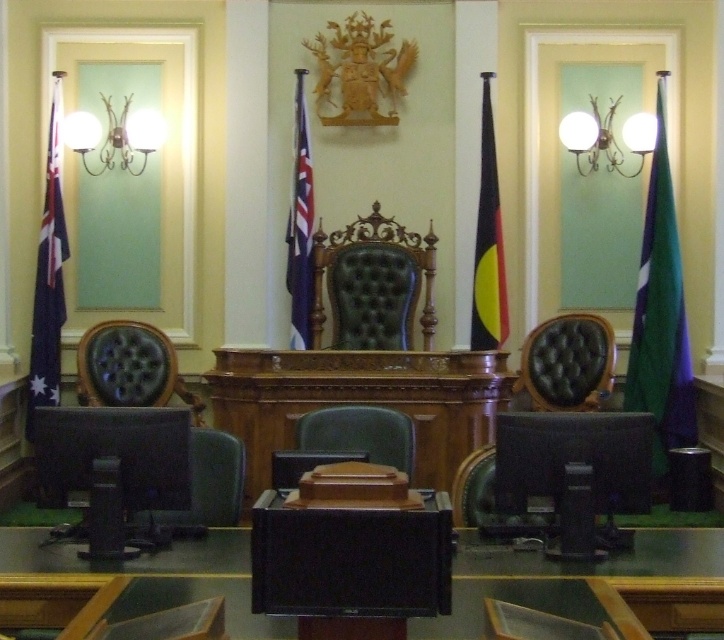
Looking at this image, who is higher up, matte black flag at left or yellow and black fabric flag at center?

yellow and black fabric flag at center is above.

Who is more forward, (30, 371) or (500, 273)?

Point (500, 273) is in front.

Is point (38, 298) farther from camera compared to point (505, 307)?

Yes, point (38, 298) is farther from viewer.

Where is `matte black flag at left`? The width and height of the screenshot is (724, 640). matte black flag at left is located at coordinates (49, 276).

Is point (315, 342) positioned in front of point (287, 252)?

That is True.

Between point (399, 314) and point (308, 179), which one is positioned in front?

Point (308, 179) is more forward.

The height and width of the screenshot is (640, 724). What do you see at coordinates (374, 284) in the screenshot?
I see `green leather chair at center` at bounding box center [374, 284].

At what (x,y) coordinates should I click in order to perform the action: click on green leather chair at center. Please return your answer as a coordinate pair (x, y). The height and width of the screenshot is (640, 724). Looking at the image, I should click on (374, 284).

Can you confirm if wooden table at center is wider than leather chair at lower right?

Indeed, wooden table at center has a greater width compared to leather chair at lower right.

Between wooden table at center and leather chair at lower right, which one appears on the left side from the viewer's perspective?

Positioned to the left is wooden table at center.

Where is `wooden table at center`? This screenshot has width=724, height=640. wooden table at center is located at coordinates (358, 401).

Image resolution: width=724 pixels, height=640 pixels. I want to click on wooden table at center, so click(358, 401).